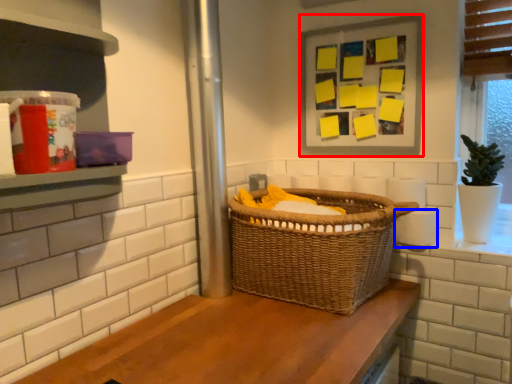
Question: Which point is closer to the camera, picture frame (highlighted by a red box) or toilet paper (highlighted by a blue box)?

Choices:
 (A) picture frame
 (B) toilet paper

Answer: (B)